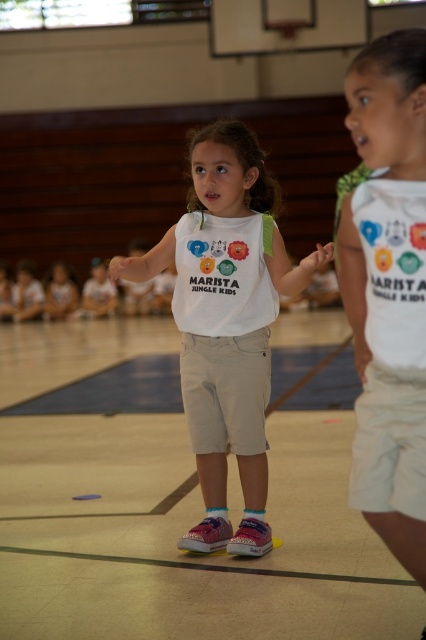
Question: Can you confirm if white cotton shirt at upper right is positioned below white cotton shirt at center?

Choices:
 (A) yes
 (B) no

Answer: (B)

Question: Does white cotton shirt at upper right appear over white cotton shirt at center?

Choices:
 (A) yes
 (B) no

Answer: (A)

Question: Can you confirm if white cotton shirt at upper right is wider than white cotton shirt at center?

Choices:
 (A) yes
 (B) no

Answer: (B)

Question: Which point is farther to the camera?

Choices:
 (A) (98, 490)
 (B) (193, 536)

Answer: (A)

Question: Estimate the real-world distances between objects in this image. Which object is farther from the smooth beige shorts at center?

Choices:
 (A) white cotton shirt at center
 (B) white cotton shirt at upper right

Answer: (B)

Question: Which of the following is the farthest from the observer?

Choices:
 (A) white cotton shirt at center
 (B) white cotton shirt at upper right

Answer: (A)